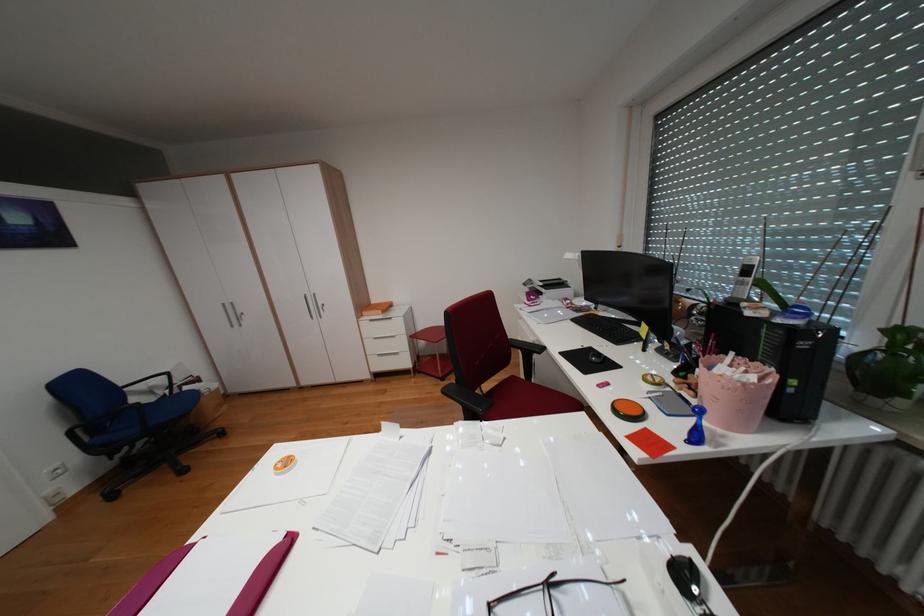
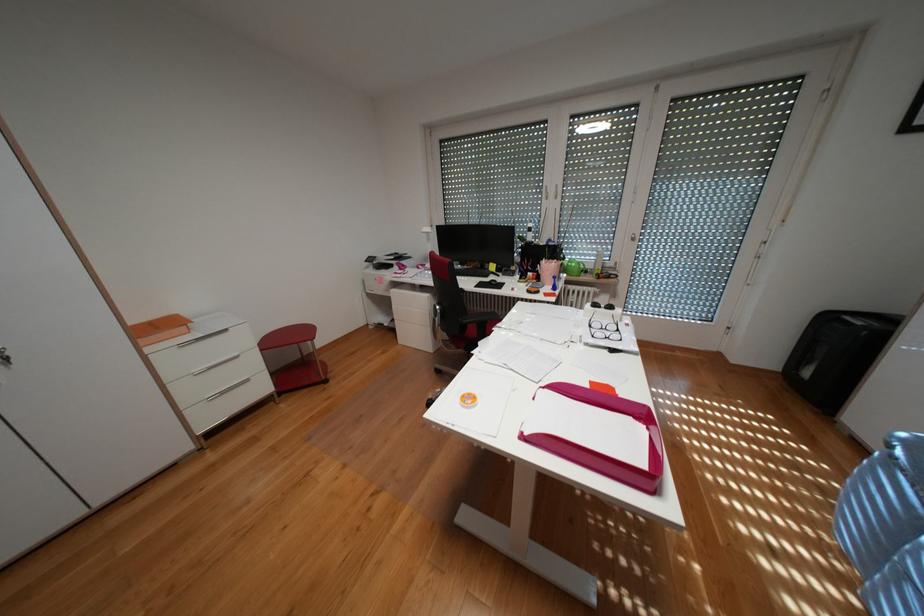
The point at (399, 306) is marked in the first image. Where is the corresponding point in the second image?

(184, 323)